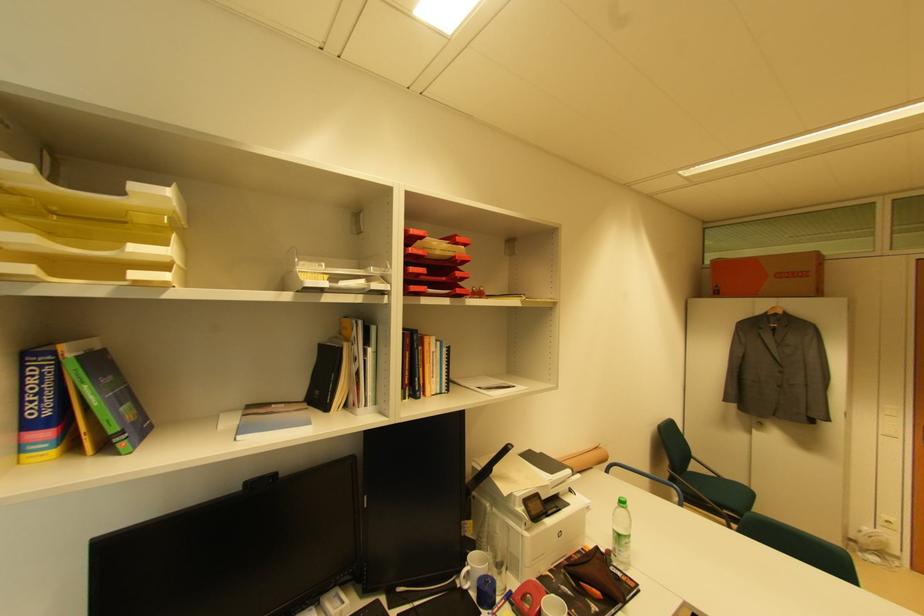
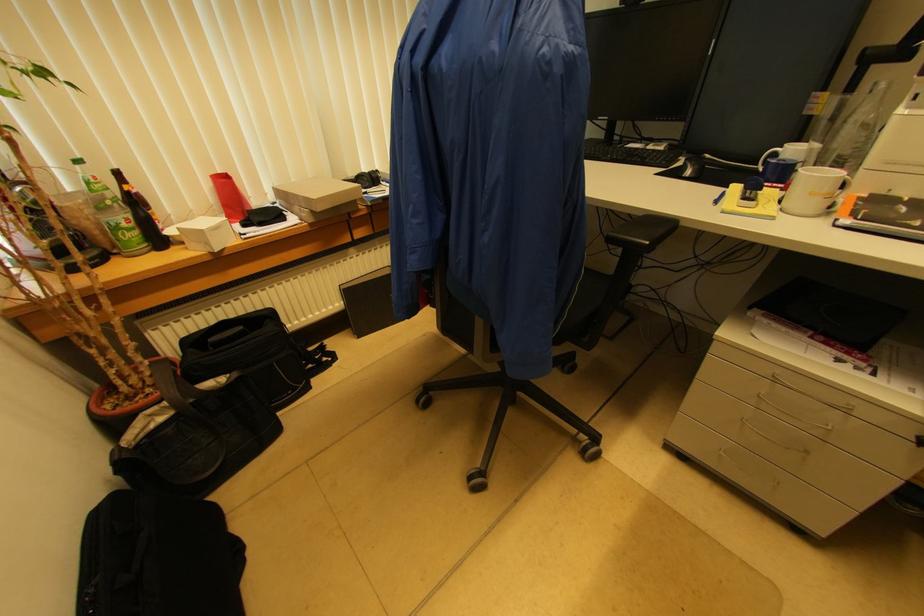
In the second image, find the point that corresponds to (x=468, y=576) in the first image.

(775, 156)